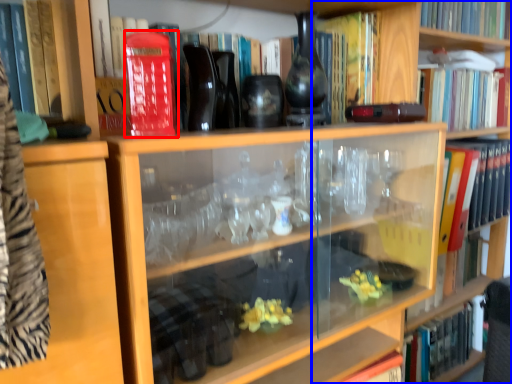
Question: Which object appears farthest to the camera in this image, paperback book (highlighted by a red box) or bookshelf (highlighted by a blue box)?

Choices:
 (A) paperback book
 (B) bookshelf

Answer: (B)